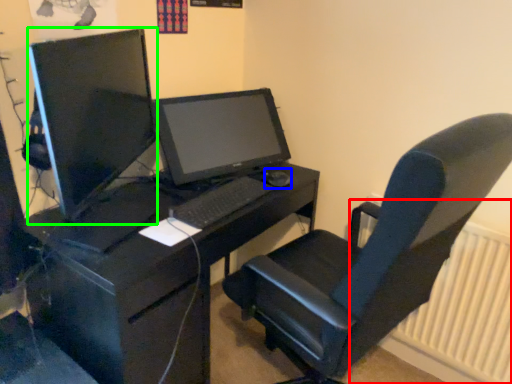
Question: Which object is the farthest from radiator (highlighted by a red box)? Choose among these: mouse (highlighted by a blue box) or computer monitor (highlighted by a green box).

Choices:
 (A) mouse
 (B) computer monitor

Answer: (B)